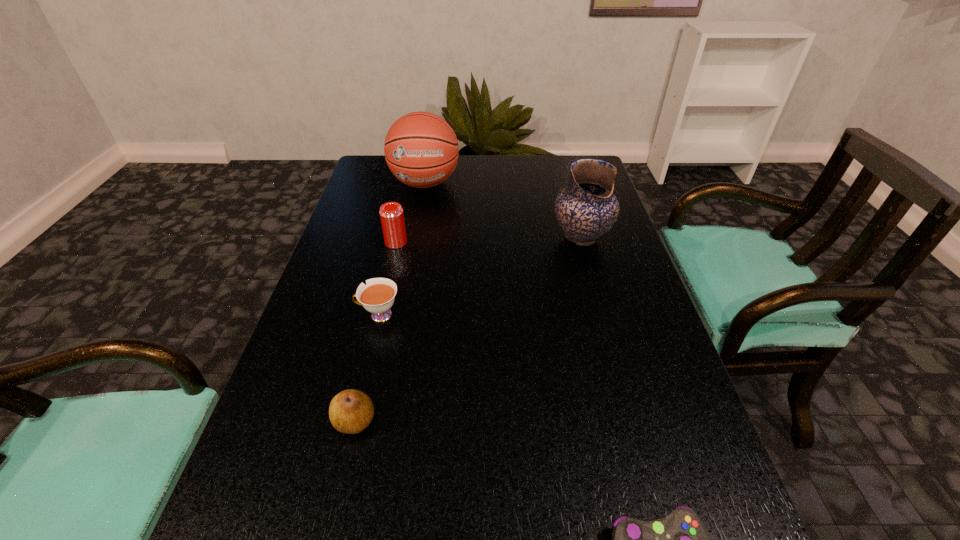
You are a GUI agent. You are given a task and a screenshot of the screen. Output one action in this format:
    pyautogui.click(x=<x>, y=<y>)
    Task: Click on the farthest object
    The height and width of the screenshot is (540, 960).
    Given the screenshot: What is the action you would take?
    pyautogui.click(x=421, y=149)

Find the location of `pottery`. pottery is located at coordinates (586, 209).

Image resolution: width=960 pixels, height=540 pixels. What are the coordinates of `beer can` in the screenshot? It's located at (391, 213).

Where is `the fifth farthest object`? the fifth farthest object is located at coordinates (351, 411).

Identify the location of teacup. point(378,296).

The width and height of the screenshot is (960, 540). Identify the location of the fourth farthest object. (378, 296).

Where is `vacant space located 0.120m on the logo side of the basketball`? vacant space located 0.120m on the logo side of the basketball is located at coordinates (418, 225).

Identify the location of blank area located 0.370m on the left of the pottery. The image size is (960, 540). (416, 237).

Identify the location of vacant space located on the back of the beer can. (404, 206).

Identify the location of vacant space located 0.300m on the right of the fifth farthest object. [x=543, y=421].